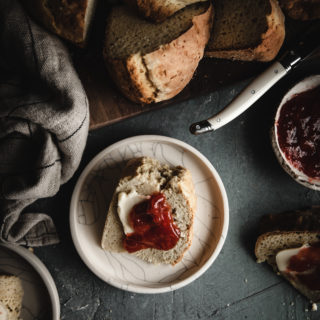
Locate an element on the screen. The image size is (320, 320). plate is located at coordinates (198, 172).